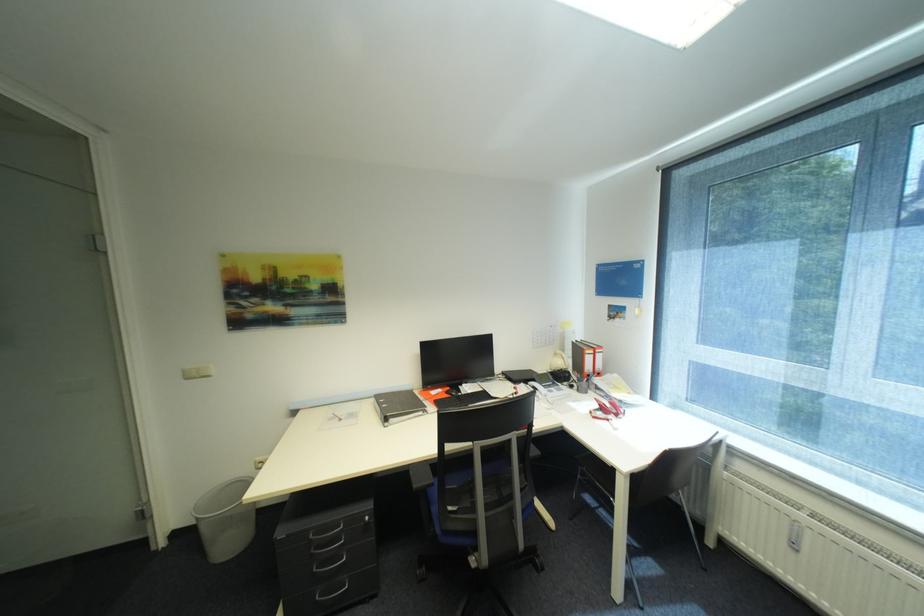
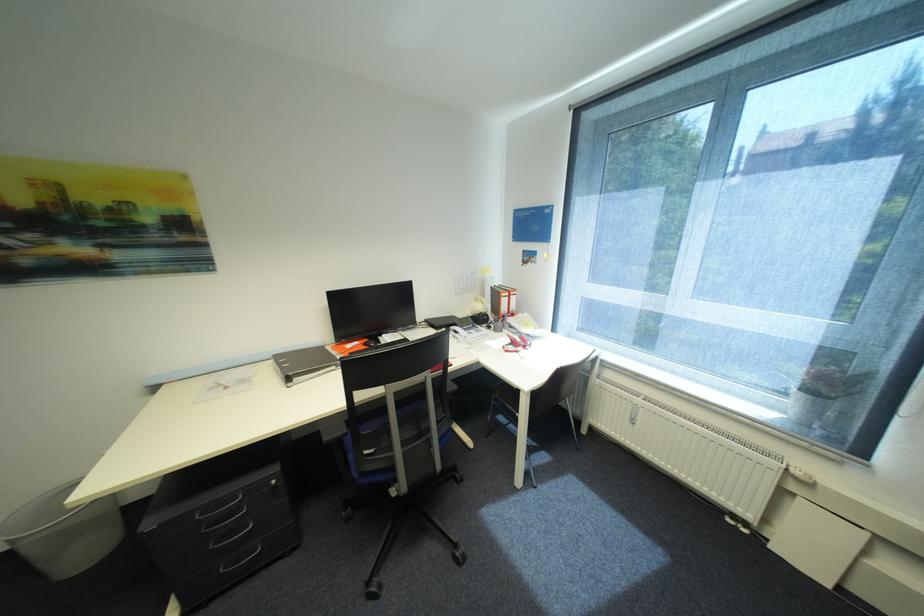
In the second image, find the point that corresponds to (x=322, y=570) in the first image.

(219, 546)